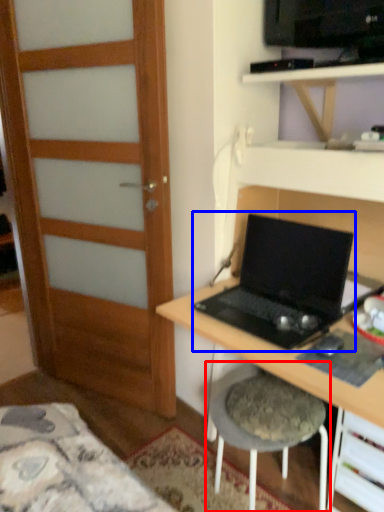
Question: Among these objects, which one is farthest to the camera, stool (highlighted by a red box) or laptop (highlighted by a blue box)?

Choices:
 (A) stool
 (B) laptop

Answer: (A)